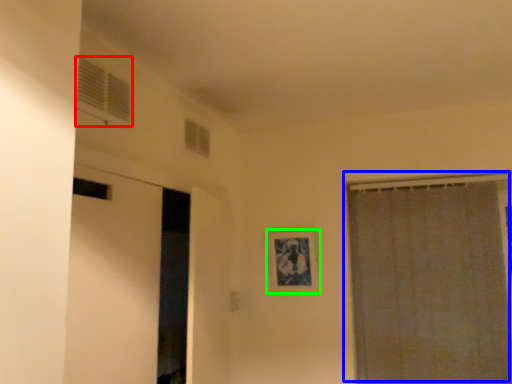
Question: Based on their relative distances, which object is nearer to window (highlighted by a red box)? Choose from curtain (highlighted by a blue box) and picture frame (highlighted by a green box).

Choices:
 (A) curtain
 (B) picture frame

Answer: (B)